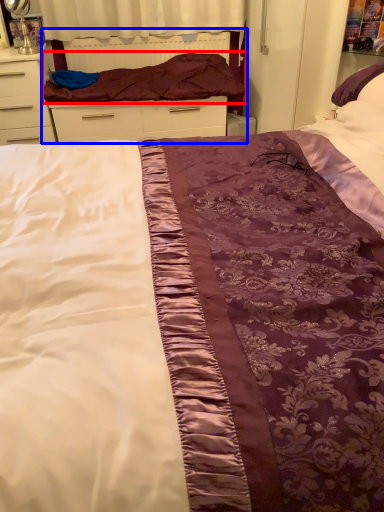
Question: Which point is closer to the camera, blanket (highlighted by a red box) or bed frame (highlighted by a blue box)?

Choices:
 (A) blanket
 (B) bed frame

Answer: (A)